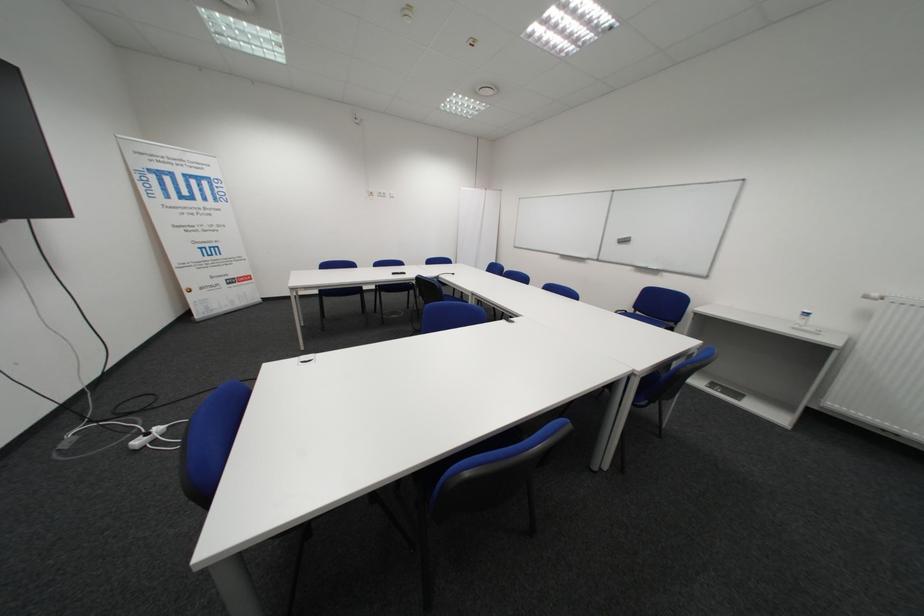
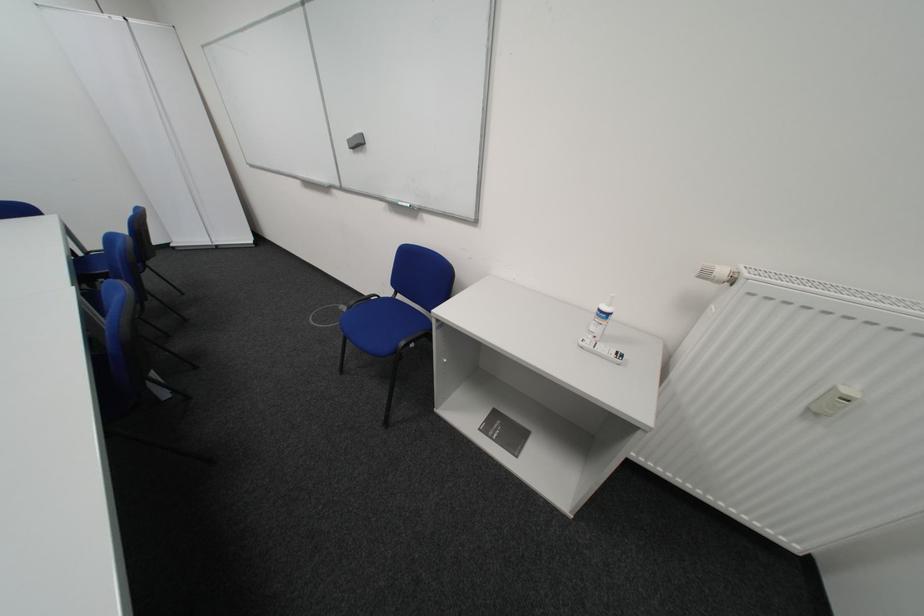
In the second image, find the point that corresponds to [808,328] in the first image.

(599, 345)